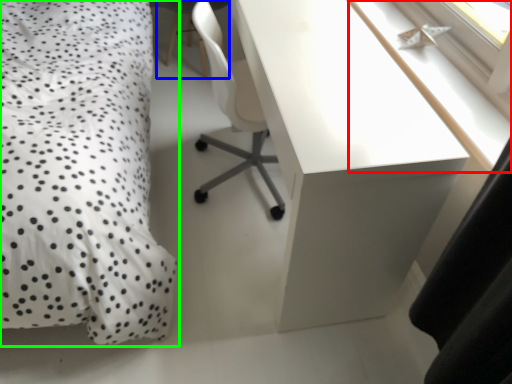
Question: Considering the real-world distances, which object is closest to window sill (highlighted by a red box)? computer chair (highlighted by a blue box) or bed (highlighted by a green box).

Choices:
 (A) computer chair
 (B) bed

Answer: (B)